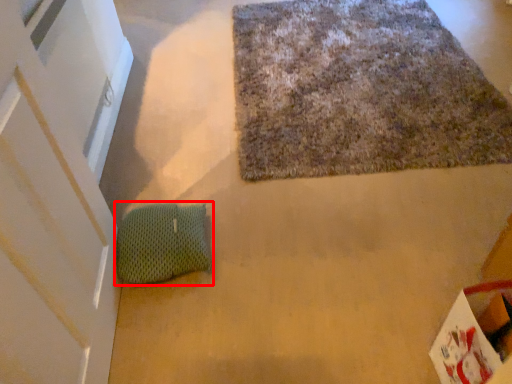
Question: Considering the relative positions of bean bag chair (annotated by the red box) and mat in the image provided, where is bean bag chair (annotated by the red box) located with respect to the staircase?

Choices:
 (A) right
 (B) left

Answer: (B)